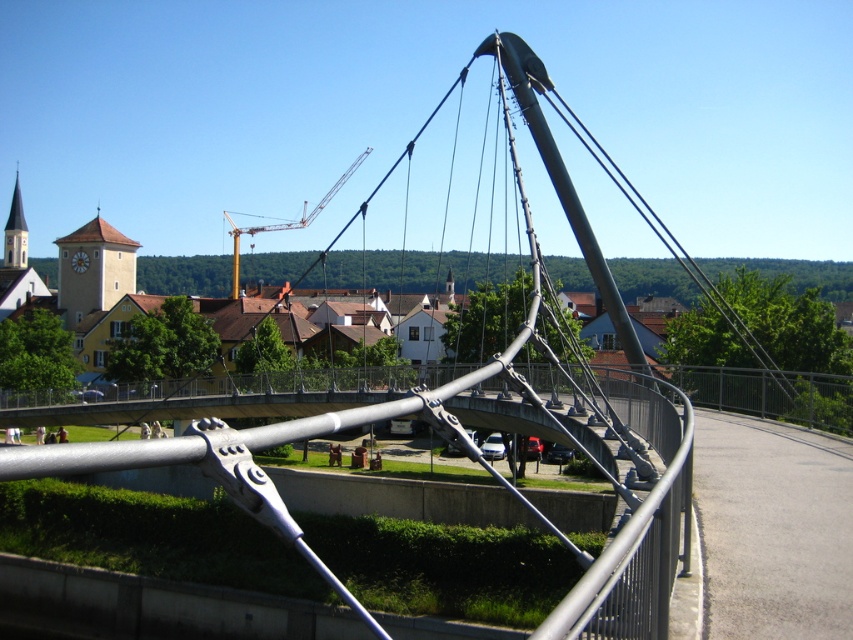
Does polished steel bridge at center appear on the right side of yellow metallic crane at upper center?

Indeed, polished steel bridge at center is positioned on the right side of yellow metallic crane at upper center.

Which is behind, point (648, 547) or point (233, 225)?

The point (233, 225) is more distant.

Identify the location of polished steel bridge at center. The image size is (853, 640). (636, 524).